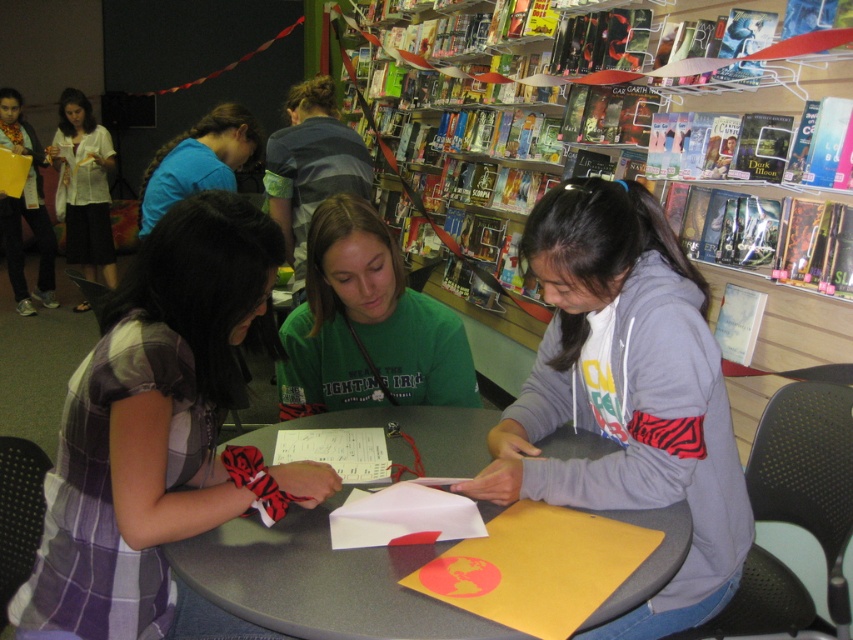
Question: Considering the relative positions of plaid fabric shirt at center and white cotton blouse at upper left in the image provided, where is plaid fabric shirt at center located with respect to white cotton blouse at upper left?

Choices:
 (A) above
 (B) below

Answer: (B)

Question: Is smooth gray table at center to the left of blue t-shirt at upper left from the viewer's perspective?

Choices:
 (A) yes
 (B) no

Answer: (B)

Question: Among these objects, which one is nearest to the camera?

Choices:
 (A) white cotton blouse at upper left
 (B) blue t-shirt at upper left

Answer: (B)

Question: Which point is farther from the camera taking this photo?

Choices:
 (A) (180, 160)
 (B) (677, 529)
 (C) (74, 99)
 (D) (366, 237)

Answer: (C)

Question: Can you confirm if gray fleece hoodie at center is positioned to the right of white cotton blouse at upper left?

Choices:
 (A) no
 (B) yes

Answer: (B)

Question: Which object appears farthest from the camera in this image?

Choices:
 (A) plaid fabric shirt at center
 (B) green matte shirt at center

Answer: (B)